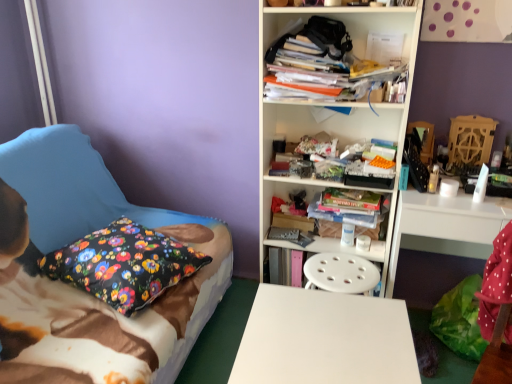
Image resolution: width=512 pixels, height=384 pixels. Identify the location of empty space that is ontop of floral fabric pillow at left (from a real-world perspective). (115, 242).